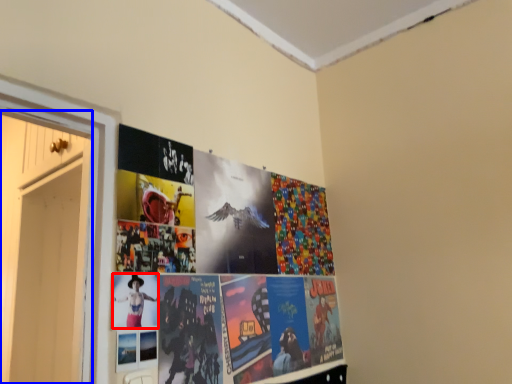
Question: Among these objects, which one is farthest to the camera, person (highlighted by a red box) or door (highlighted by a blue box)?

Choices:
 (A) person
 (B) door

Answer: (B)